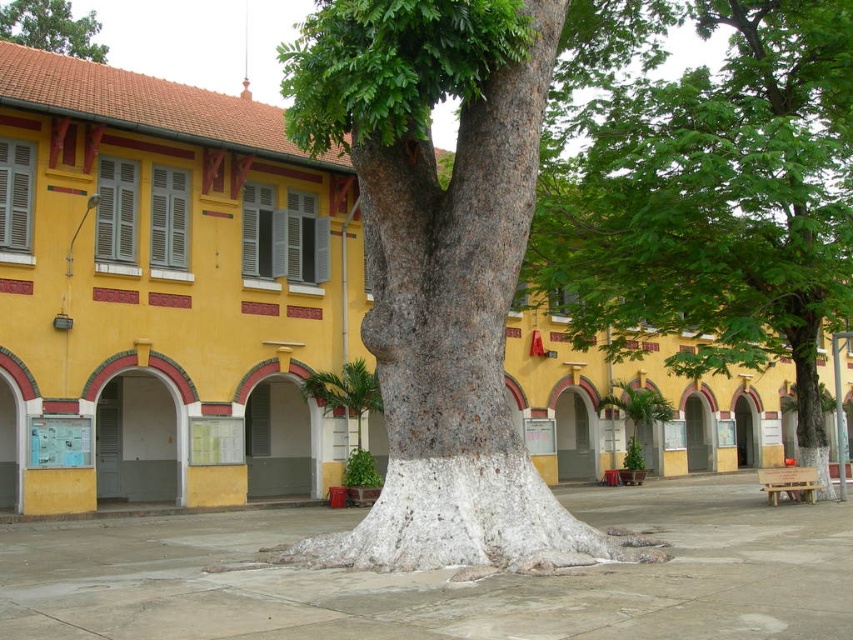
Question: Considering the real-world distances, which object is closest to the smooth bark tree at center?

Choices:
 (A) green rough bark tree at upper center
 (B) green leafy tree at center

Answer: (B)

Question: Which point is farther to the camera?

Choices:
 (A) green rough bark tree at upper center
 (B) smooth bark tree at center
 (C) green leafy tree at center

Answer: (A)

Question: Which is farther from the green leafy tree at center?

Choices:
 (A) green rough bark tree at upper center
 (B) smooth bark tree at center

Answer: (A)

Question: Does green leafy tree at center lie behind green rough bark tree at upper center?

Choices:
 (A) no
 (B) yes

Answer: (A)

Question: Is smooth bark tree at center bigger than green leafy tree at center?

Choices:
 (A) no
 (B) yes

Answer: (B)

Question: Is the position of smooth bark tree at center more distant than that of green rough bark tree at upper center?

Choices:
 (A) no
 (B) yes

Answer: (A)